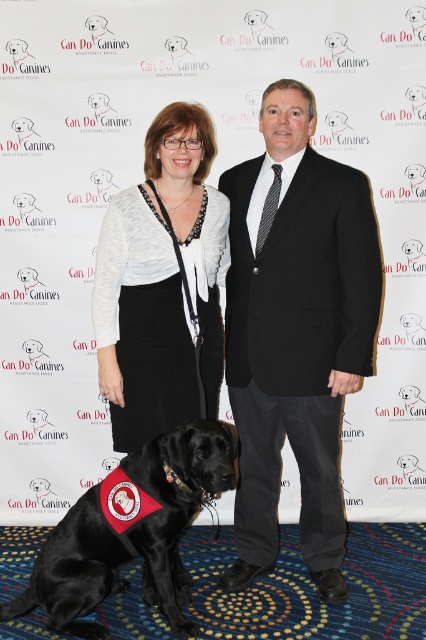
Who is more forward, (319, 525) or (72, 579)?

Positioned in front is point (72, 579).

Between black wool suit at center and black fabric dog at center, which one appears on the right side from the viewer's perspective?

black wool suit at center is more to the right.

Is point (310, 426) positioned in front of point (141, 449)?

No, it is not.

I want to click on black wool suit at center, so click(296, 332).

Can you confirm if black wool suit at center is positioned to the left of matte white blouse at center?

Incorrect, black wool suit at center is not on the left side of matte white blouse at center.

Does point (328, 451) lie in front of point (135, 406)?

That is False.

You are a GUI agent. You are given a task and a screenshot of the screen. Output one action in this format:
    pyautogui.click(x=<x>, y=<y>)
    Task: Click on the black wool suit at center
    
    Given the screenshot: What is the action you would take?
    pyautogui.click(x=296, y=332)

Does point (134, 328) lie behind point (13, 602)?

That is False.

Does matte white blouse at center have a greater height compared to black fabric dog at center?

Yes.

Is point (170, 134) closer to camera compared to point (120, 544)?

No, (170, 134) is further to viewer.

At what (x,y) coordinates should I click in order to perform the action: click on matte white blouse at center. Please return your answer as a coordinate pair (x, y). This screenshot has width=426, height=640. Looking at the image, I should click on (141, 323).